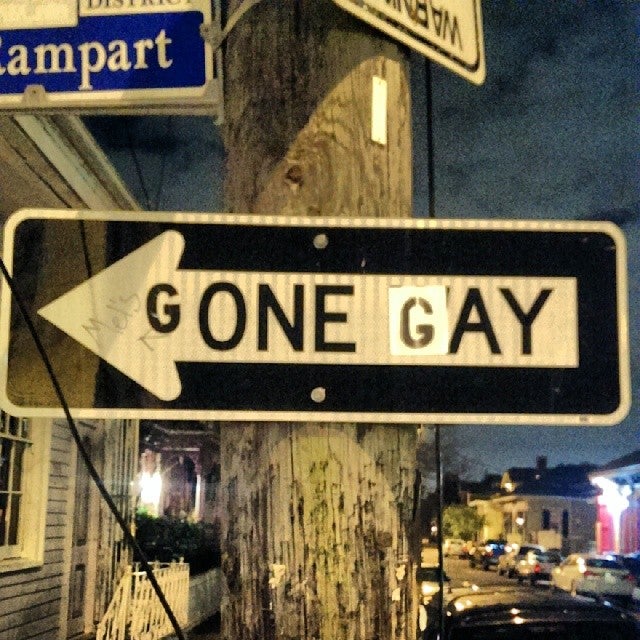
What are the coordinates of `window of house` in the screenshot? It's located at (11, 476).